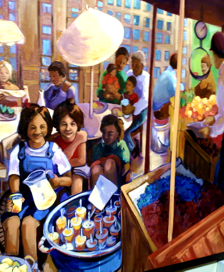
This screenshot has height=272, width=224. What are the coordinates of `blue drink cup` in the screenshot? It's located at (124, 101).